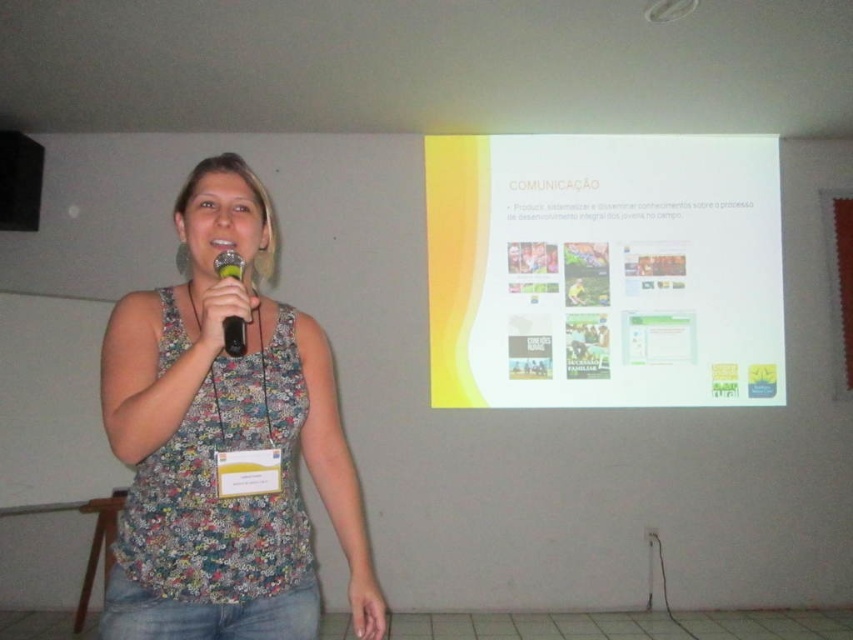
Question: Which of these objects is positioned farthest from the floral fabric tank top at center?

Choices:
 (A) matte black microphone at center
 (B) yellow matte projector screen at upper center

Answer: (B)

Question: Can you confirm if floral fabric tank top at center is smaller than matte black microphone at center?

Choices:
 (A) no
 (B) yes

Answer: (A)

Question: Which object is closer to the camera taking this photo?

Choices:
 (A) matte black microphone at center
 (B) yellow matte projector screen at upper center

Answer: (A)

Question: Estimate the real-world distances between objects in this image. Which object is closer to the floral fabric tank top at center?

Choices:
 (A) matte black microphone at center
 (B) yellow matte projector screen at upper center

Answer: (A)

Question: Where is yellow matte projector screen at upper center located in relation to matte black microphone at center in the image?

Choices:
 (A) below
 (B) above

Answer: (B)

Question: Can you confirm if yellow matte projector screen at upper center is positioned above floral fabric tank top at center?

Choices:
 (A) yes
 (B) no

Answer: (A)